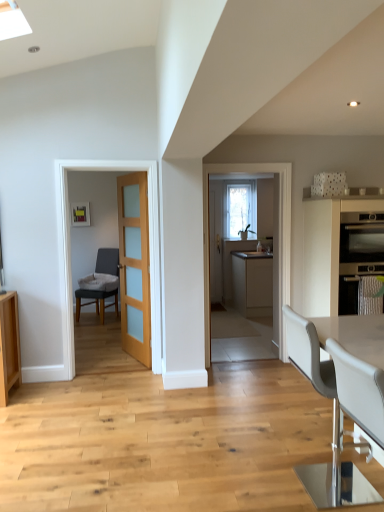
What do you see at coordinates (340, 251) in the screenshot? This screenshot has width=384, height=512. I see `matte black oven at right, which is counted as the second cabinetry, starting from the back` at bounding box center [340, 251].

The height and width of the screenshot is (512, 384). I want to click on matte beige cabinet at center, the first cabinetry when ordered from back to front, so click(x=252, y=283).

How much space does white leather chair at lower right, placed as the second chair when sorted from front to back, occupy horizontally?

52.26 centimeters.

Identify the location of white leather chair at lower right, the 2th chair positioned from the back. The height and width of the screenshot is (512, 384). (333, 423).

Describe the element at coordinates (240, 208) in the screenshot. I see `clear glass window at center` at that location.

Locate an element on the screen. This screenshot has height=512, width=384. dark gray fabric chair at left, acting as the first chair starting from the left is located at coordinates (96, 300).

This screenshot has height=512, width=384. In order to click on matte black oven at right, the first cabinetry in the front-to-back sequence in this screenshot , I will do `click(340, 251)`.

Can you tell me how much matte stainless steel oven at right and white leather chair at lower right, acting as the second chair starting from the left, differ in facing direction?

The angle between the facing direction of matte stainless steel oven at right and the facing direction of white leather chair at lower right, acting as the second chair starting from the left, is 88.6 degrees.

From a real-world perspective, is matte stainless steel oven at right positioned under white leather chair at lower right, marked as the second chair in a right-to-left arrangement, based on gravity?

Incorrect, from a real-world perspective, matte stainless steel oven at right is higher than white leather chair at lower right, marked as the second chair in a right-to-left arrangement.

From the image's perspective, does matte stainless steel oven at right appear higher than white leather chair at lower right, marked as the second chair in a right-to-left arrangement?

Yes, from the image's perspective, matte stainless steel oven at right is over white leather chair at lower right, marked as the second chair in a right-to-left arrangement.

Considering the positions of points (363, 256) and (370, 419), is point (363, 256) closer to camera compared to point (370, 419)?

That is False.

Starting from the matte beige cabinet at center, which is counted as the second cabinetry, starting from the front, which chair is the 3rd one to the left? Please provide its 2D coordinates.

[(96, 300)]

Is matte beige cabinet at center, the first cabinetry when ordered from back to front, looking in the opposite direction of dark gray fabric chair at left, which appears as the third chair when viewed from the front?

No, matte beige cabinet at center, the first cabinetry when ordered from back to front, is not facing the opposite direction of dark gray fabric chair at left, which appears as the third chair when viewed from the front.

Is matte beige cabinet at center, the first cabinetry when ordered from back to front, taller or shorter than dark gray fabric chair at left, the first chair positioned from the back?

matte beige cabinet at center, the first cabinetry when ordered from back to front, is shorter than dark gray fabric chair at left, the first chair positioned from the back.

Measure the distance between matte beige cabinet at center, which is counted as the second cabinetry, starting from the front, and dark gray fabric chair at left, which appears as the third chair when viewed from the front.

matte beige cabinet at center, which is counted as the second cabinetry, starting from the front, is 7.67 feet from dark gray fabric chair at left, which appears as the third chair when viewed from the front.

Which of these two, matte stainless steel oven at right or white leather chair at lower right, the 2th chair positioned from the back, is bigger?

white leather chair at lower right, the 2th chair positioned from the back.

Looking at their sizes, would you say matte stainless steel oven at right is wider or thinner than white leather chair at lower right, placed as the second chair when sorted from front to back?

Clearly, matte stainless steel oven at right has more width compared to white leather chair at lower right, placed as the second chair when sorted from front to back.

Find the location of a particular element. The height and width of the screenshot is (512, 384). chair that is the 3rd one when counting downward from the matte stainless steel oven at right (from the image's perspective) is located at coordinates (333, 423).

Is point (342, 257) positioned after point (296, 362)?

Yes, point (342, 257) is farther from viewer.

Is white leather chair at lower right, the 2th chair positioned from the back, far away from matte black oven at right, which is counted as the second cabinetry, starting from the back?

Indeed, white leather chair at lower right, the 2th chair positioned from the back, is not near matte black oven at right, which is counted as the second cabinetry, starting from the back.

Based on their positions, is white leather chair at lower right, which appears as the third chair when viewed from the left, located to the left or right of matte black oven at right, the first cabinetry in the front-to-back sequence?

From the image, it's evident that white leather chair at lower right, which appears as the third chair when viewed from the left, is to the left of matte black oven at right, the first cabinetry in the front-to-back sequence.

Is white leather chair at lower right, which appears as the third chair when viewed from the left, aimed at matte black oven at right, which is counted as the second cabinetry, starting from the back?

No, white leather chair at lower right, which appears as the third chair when viewed from the left, is not turned towards matte black oven at right, which is counted as the second cabinetry, starting from the back.

Which is less distant, [109,295] or [146,361]?

The point [146,361] is in front.

Considering the sizes of objects dark gray fabric chair at left, the 3th chair when ordered from right to left, and light brown wood door at center in the image provided, who is bigger, dark gray fabric chair at left, the 3th chair when ordered from right to left, or light brown wood door at center?

Bigger between the two is dark gray fabric chair at left, the 3th chair when ordered from right to left.

Is light brown wood door at center located within dark gray fabric chair at left, which appears as the third chair when viewed from the front?

No.

Consider the image. Is dark gray fabric chair at left, which appears as the third chair when viewed from the front, aimed at light brown wood door at center?

No, dark gray fabric chair at left, which appears as the third chair when viewed from the front, is not turned towards light brown wood door at center.

Between point (143, 279) and point (336, 220), which one is positioned behind?

Point (143, 279)

Does light brown wood door at center appear on the right side of matte black oven at right, which is counted as the second cabinetry, starting from the back?

No, light brown wood door at center is not to the right of matte black oven at right, which is counted as the second cabinetry, starting from the back.

Is light brown wood door at center looking in the opposite direction of matte black oven at right, the first cabinetry in the front-to-back sequence?

No.

From a real-world perspective, which is physically below, matte beige cabinet at center, the first cabinetry when ordered from back to front, or light brown wood door at center?

matte beige cabinet at center, the first cabinetry when ordered from back to front.

Looking at this image, is light brown wood door at center surrounded by matte beige cabinet at center, the first cabinetry when ordered from back to front?

No, matte beige cabinet at center, the first cabinetry when ordered from back to front, does not contain light brown wood door at center.

Is matte beige cabinet at center, which is counted as the second cabinetry, starting from the front, wider than light brown wood door at center?

Correct, the width of matte beige cabinet at center, which is counted as the second cabinetry, starting from the front, exceeds that of light brown wood door at center.

Locate an element on the screen. The image size is (384, 512). the 2nd chair to the left of the matte stainless steel oven at right, starting your count from the anchor is located at coordinates (359, 391).

The height and width of the screenshot is (512, 384). What are the coordinates of `the 2nd chair located above the matte beige cabinet at center, the first cabinetry when ordered from back to front (from a real-world perspective)` in the screenshot? It's located at (96, 300).

When comparing their distances from matte beige cabinet at center, which is counted as the second cabinetry, starting from the front, does matte black oven at right, the first cabinetry in the front-to-back sequence, or matte stainless steel oven at right seem further?

Among the two, matte stainless steel oven at right is located further to matte beige cabinet at center, which is counted as the second cabinetry, starting from the front.

From the image, which object appears to be farther from white leather chair at lower right, the third chair from the back, matte black oven at right, the first cabinetry in the front-to-back sequence, or clear glass window at center?

clear glass window at center is positioned further to the anchor white leather chair at lower right, the third chair from the back.

From the image, which object appears to be nearer to clear glass window at center, white leather chair at lower right, which appears as the third chair when viewed from the left, or light brown wood door at center?

The object closer to clear glass window at center is light brown wood door at center.

Looking at the image, which one is located closer to dark gray fabric chair at left, the first chair positioned from the back, light brown wood door at center or clear glass window at center?

light brown wood door at center.

Estimate the real-world distances between objects in this image. Which object is further from clear glass window at center, matte stainless steel oven at right or dark gray fabric chair at left, which appears as the third chair when viewed from the front?

matte stainless steel oven at right.

Looking at the image, which one is located further to white leather chair at lower right, which appears as the third chair when viewed from the left, matte beige cabinet at center, the first cabinetry when ordered from back to front, or clear glass window at center?

clear glass window at center is further to white leather chair at lower right, which appears as the third chair when viewed from the left.

From the picture: Estimate the real-world distances between objects in this image. Which object is further from clear glass window at center, matte black oven at right, the first cabinetry in the front-to-back sequence, or light brown wood door at center?

The object further to clear glass window at center is matte black oven at right, the first cabinetry in the front-to-back sequence.

Looking at the image, which one is located further to clear glass window at center, white leather chair at lower right, marked as the second chair in a right-to-left arrangement, or white leather chair at lower right, the 1th chair viewed from the right?

Among the two, white leather chair at lower right, marked as the second chair in a right-to-left arrangement, is located further to clear glass window at center.

Image resolution: width=384 pixels, height=512 pixels. Identify the location of door positioned between matte stainless steel oven at right and matte beige cabinet at center, which is counted as the second cabinetry, starting from the front, from near to far. (134, 266).

Locate an element on the screen. The image size is (384, 512). cabinetry positioned between light brown wood door at center and clear glass window at center from near to far is located at coordinates (252, 283).

Find the location of `door positioned between white leather chair at lower right, the third chair from the back, and dark gray fabric chair at left, which appears as the third chair when viewed from the front, from near to far`. door positioned between white leather chair at lower right, the third chair from the back, and dark gray fabric chair at left, which appears as the third chair when viewed from the front, from near to far is located at coordinates (134, 266).

Find the location of a particular element. This screenshot has height=512, width=384. door between white leather chair at lower right, the 2th chair positioned from the back, and clear glass window at center in the front-back direction is located at coordinates (134, 266).